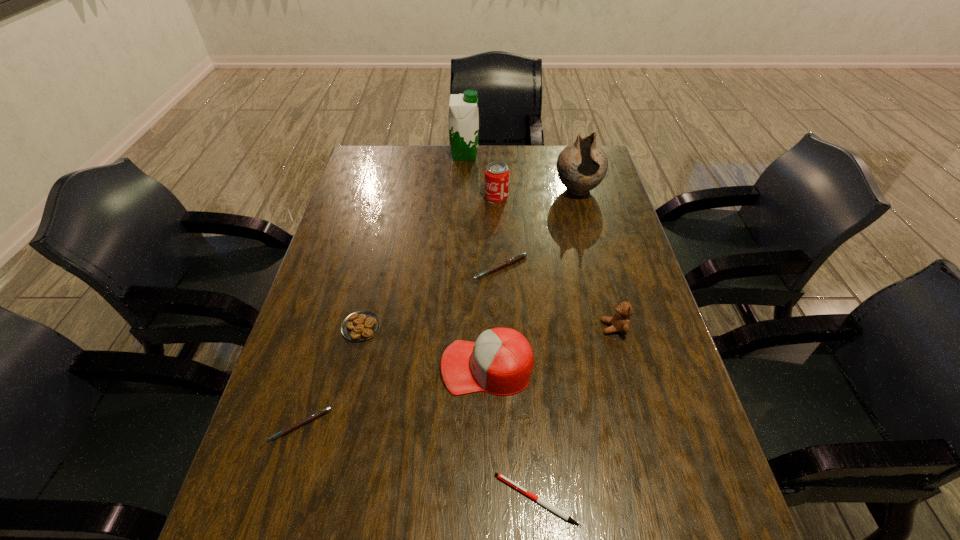
Locate an element on the screen. The image size is (960, 540). the second nearest pen is located at coordinates (312, 417).

Locate an element on the screen. The width and height of the screenshot is (960, 540). the nearer pink pen is located at coordinates (312, 417).

I want to click on the nearest object, so click(539, 500).

Image resolution: width=960 pixels, height=540 pixels. What are the coordinates of `the nearest pen` in the screenshot? It's located at (539, 500).

Where is `vacant space located 0.160m on the front-facing side of the farthest object`? Image resolution: width=960 pixels, height=540 pixels. vacant space located 0.160m on the front-facing side of the farthest object is located at coordinates (520, 155).

At what (x,y) coordinates should I click in order to perform the action: click on vacant region located from the spout of the pottery. Please return your answer as a coordinate pair (x, y). The height and width of the screenshot is (540, 960). Looking at the image, I should click on (591, 243).

Where is `vacant point located on the front of the can`? This screenshot has height=540, width=960. vacant point located on the front of the can is located at coordinates (500, 294).

Locate an element on the screen. free space located 0.350m on the face of the brown teddy bear is located at coordinates (463, 327).

This screenshot has height=540, width=960. In order to click on vacant space positioned on the face of the brown teddy bear in this screenshot , I will do `click(570, 327)`.

Locate an element on the screen. This screenshot has height=540, width=960. free region located 0.330m on the face of the brown teddy bear is located at coordinates (471, 327).